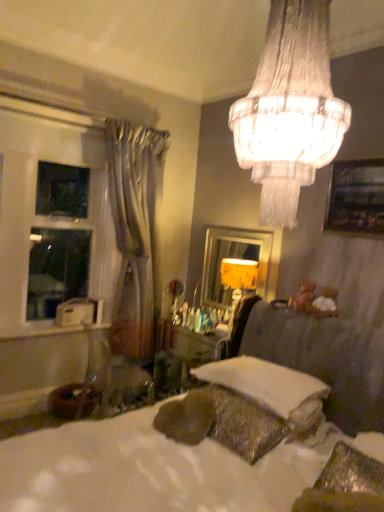
Question: In which direction should I rotate to look at crystalline glass chandelier at upper center?

Choices:
 (A) left
 (B) right

Answer: (B)

Question: Would you consider white glossy window at left to be distant from silvery drapery at left?

Choices:
 (A) yes
 (B) no

Answer: (B)

Question: Is white glossy window at left aimed at silvery drapery at left?

Choices:
 (A) no
 (B) yes

Answer: (B)

Question: Can silvery drapery at left be found inside white glossy window at left?

Choices:
 (A) no
 (B) yes

Answer: (A)

Question: From the image's perspective, is white glossy window at left under silvery drapery at left?

Choices:
 (A) no
 (B) yes

Answer: (A)

Question: Is white glossy window at left taller than silvery drapery at left?

Choices:
 (A) no
 (B) yes

Answer: (A)

Question: Can you confirm if white glossy window at left is positioned to the left of silvery drapery at left?

Choices:
 (A) yes
 (B) no

Answer: (A)

Question: Can you confirm if white glossy window at left is positioned to the right of white soft pillow at lower center?

Choices:
 (A) yes
 (B) no

Answer: (B)

Question: Can we say white glossy window at left lies outside white soft pillow at lower center?

Choices:
 (A) no
 (B) yes

Answer: (B)

Question: From the image's perspective, is white glossy window at left over white soft pillow at lower center?

Choices:
 (A) yes
 (B) no

Answer: (A)

Question: Is white glossy window at left facing away from white soft pillow at lower center?

Choices:
 (A) yes
 (B) no

Answer: (B)

Question: Is white glossy window at left placed right next to white soft pillow at lower center?

Choices:
 (A) yes
 (B) no

Answer: (B)

Question: Considering the relative sizes of white glossy window at left and white soft pillow at lower center in the image provided, is white glossy window at left shorter than white soft pillow at lower center?

Choices:
 (A) yes
 (B) no

Answer: (B)

Question: Does crystalline glass chandelier at upper center touch white textured bed at center?

Choices:
 (A) yes
 (B) no

Answer: (B)